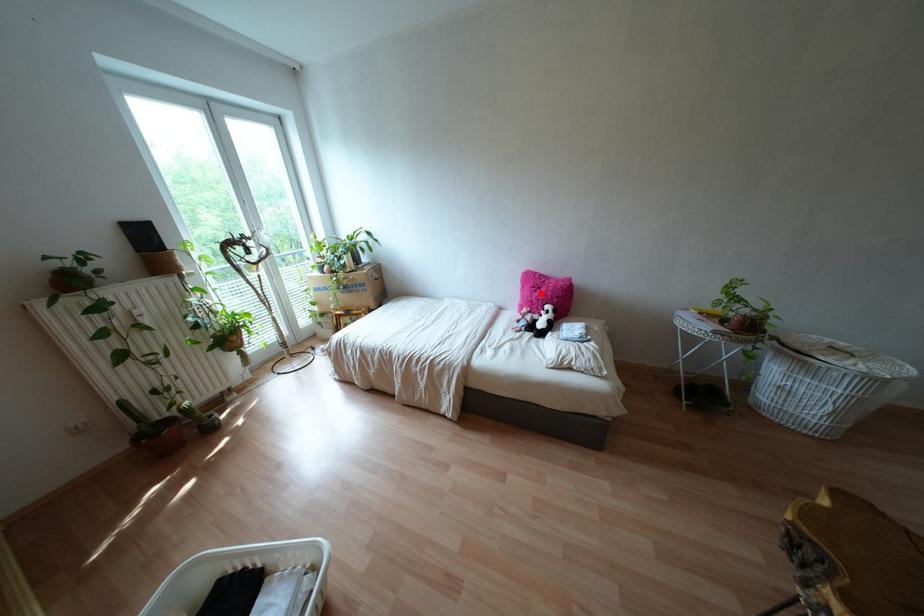
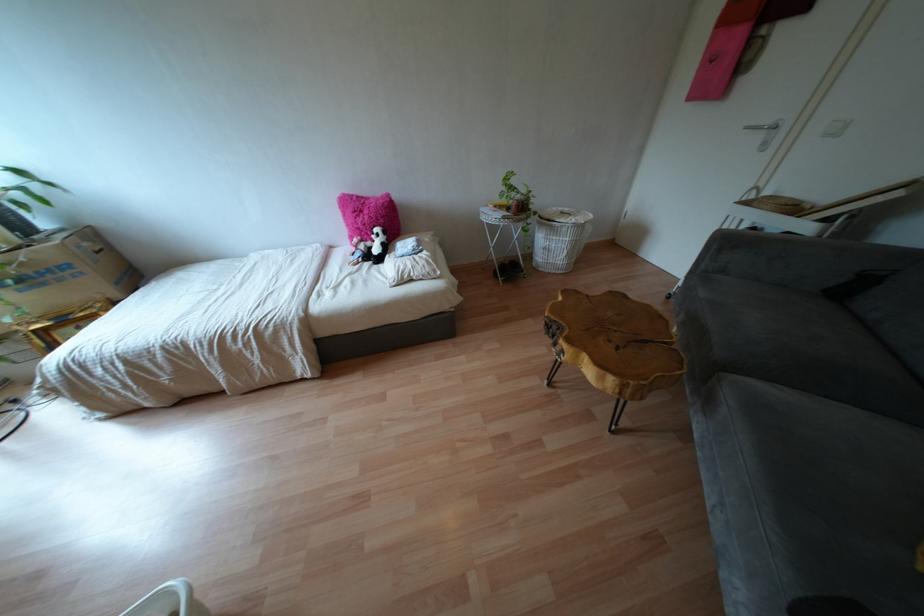
In the second image, find the point that corresponds to the highlighted location in the first image.

(365, 217)